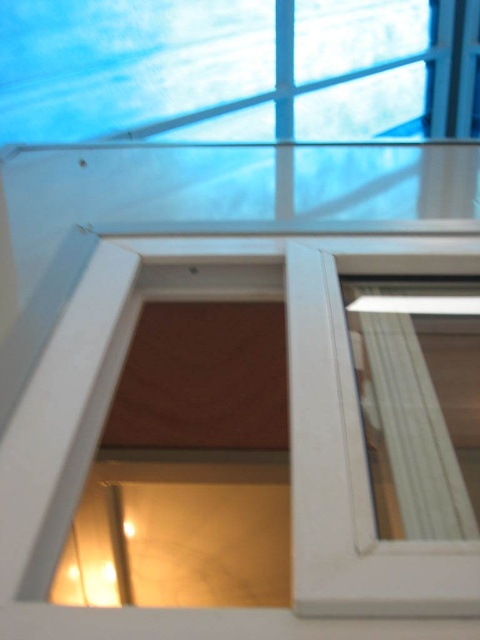
You are standing in a room and looking at the white matte window frame at center and the clear glass window at center. Which object is nearer to you?

The white matte window frame at center is closer to the viewer than the clear glass window at center.

You are a painter trying to paint the white matte window frame at center and the clear glass window at center. Which object requires more paint because it has a larger surface area?

The white matte window frame at center requires more paint because it is taller than the clear glass window at center, resulting in a larger surface area.